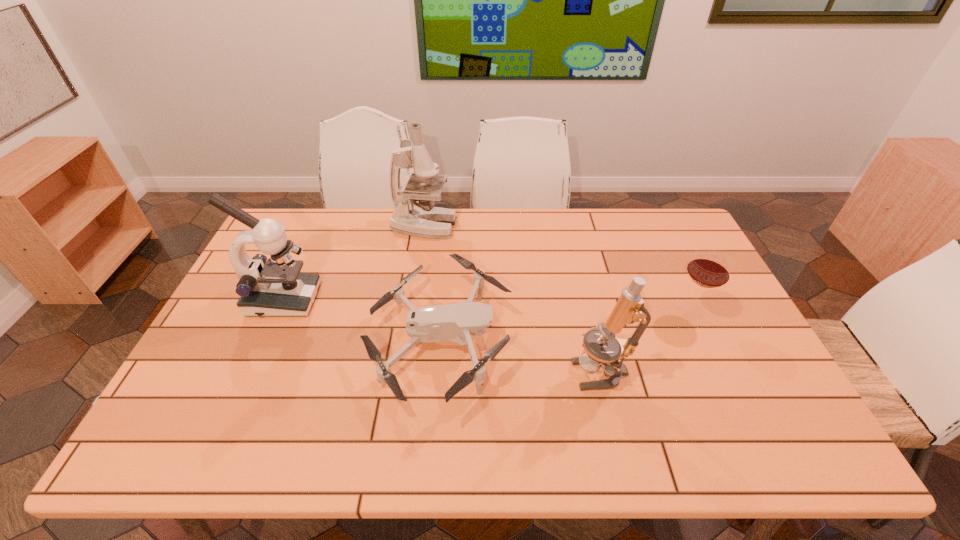
You are a GUI agent. You are given a task and a screenshot of the screen. Output one action in this format:
    pyautogui.click(x=<x>, y=<y>)
    Task: Click on the free space between the farthest object and the leftmost object
    This screenshot has width=960, height=540.
    Given the screenshot: What is the action you would take?
    pyautogui.click(x=353, y=263)

The height and width of the screenshot is (540, 960). I want to click on vacant space that is in between the drone and the rightmost microscope, so click(x=520, y=357).

At what (x,y) coordinates should I click in order to perform the action: click on free space between the nearest microscope and the farthest object. Please return your answer as a coordinate pair (x, y). This screenshot has width=960, height=540. Looking at the image, I should click on (513, 299).

Locate an element on the screen. This screenshot has width=960, height=540. free spot between the farthest microscope and the leftmost object is located at coordinates (353, 263).

Locate an element on the screen. This screenshot has width=960, height=540. vacant space that's between the fourth object from left to right and the shortest object is located at coordinates (520, 357).

Where is `empty space that is in between the shortest object and the second shortest object`? empty space that is in between the shortest object and the second shortest object is located at coordinates (565, 327).

Identify which object is the second nearest to the drone. Please provide its 2D coordinates. Your answer should be formatted as a tuple, i.e. [(x, y)], where the tuple contains the x and y coordinates of a point satisfying the conditions above.

[(267, 287)]

Identify which object is the fourth closest to the rightmost microscope. Please provide its 2D coordinates. Your answer should be formatted as a tuple, i.e. [(x, y)], where the tuple contains the x and y coordinates of a point satisfying the conditions above.

[(267, 287)]

Select which microscope is the closest to the leftmost microscope. Please provide its 2D coordinates. Your answer should be formatted as a tuple, i.e. [(x, y)], where the tuple contains the x and y coordinates of a point satisfying the conditions above.

[(424, 220)]

You are a GUI agent. You are given a task and a screenshot of the screen. Output one action in this format:
    pyautogui.click(x=<x>, y=<y>)
    Task: Click on the microscope that is the second closest one to the second nearest microscope
    The width and height of the screenshot is (960, 540).
    Given the screenshot: What is the action you would take?
    (629, 308)